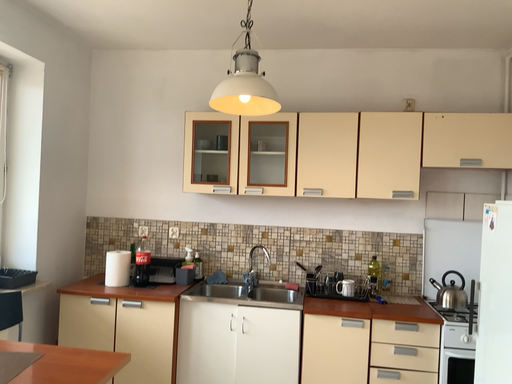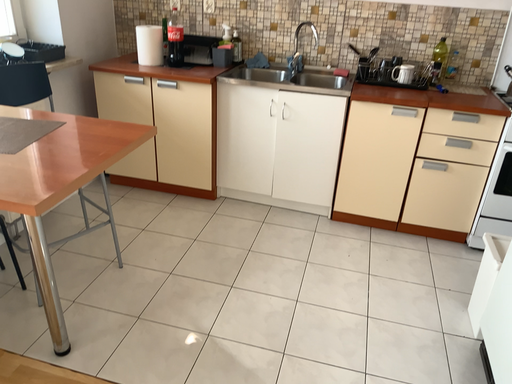
Question: Which way did the camera rotate in the video?

Choices:
 (A) rotated left
 (B) rotated right

Answer: (A)